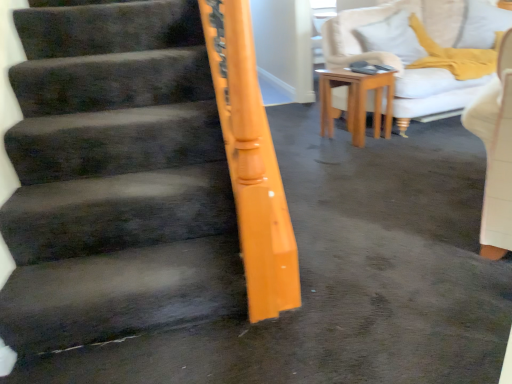
Question: Should I look upward or downward to see light brown wooden table at center?

Choices:
 (A) up
 (B) down

Answer: (A)

Question: Can you confirm if white soft pillow at upper right is taller than light brown wooden table at center?

Choices:
 (A) yes
 (B) no

Answer: (B)

Question: Considering the relative sizes of white soft pillow at upper right and light brown wooden table at center in the image provided, is white soft pillow at upper right shorter than light brown wooden table at center?

Choices:
 (A) yes
 (B) no

Answer: (A)

Question: Considering the relative sizes of white soft pillow at upper right and light brown wooden table at center in the image provided, is white soft pillow at upper right smaller than light brown wooden table at center?

Choices:
 (A) no
 (B) yes

Answer: (A)

Question: From the image's perspective, is white soft pillow at upper right located beneath light brown wooden table at center?

Choices:
 (A) no
 (B) yes

Answer: (A)

Question: Considering the relative positions of white soft pillow at upper right and light brown wooden table at center in the image provided, is white soft pillow at upper right behind light brown wooden table at center?

Choices:
 (A) yes
 (B) no

Answer: (A)

Question: Does white soft pillow at upper right appear on the left side of light brown wooden table at center?

Choices:
 (A) yes
 (B) no

Answer: (B)

Question: From a real-world perspective, is light brown wooden table at center positioned under white soft pillow at upper right based on gravity?

Choices:
 (A) no
 (B) yes

Answer: (B)

Question: Considering the relative sizes of light brown wooden table at center and white soft pillow at upper right in the image provided, is light brown wooden table at center thinner than white soft pillow at upper right?

Choices:
 (A) yes
 (B) no

Answer: (B)

Question: Is light brown wooden table at center oriented towards white soft pillow at upper right?

Choices:
 (A) no
 (B) yes

Answer: (A)

Question: Considering the relative sizes of light brown wooden table at center and white soft pillow at upper right in the image provided, is light brown wooden table at center bigger than white soft pillow at upper right?

Choices:
 (A) no
 (B) yes

Answer: (A)

Question: Is light brown wooden table at center further to the viewer compared to white soft pillow at upper right?

Choices:
 (A) yes
 (B) no

Answer: (B)

Question: From the image's perspective, is light brown wooden table at center under white soft pillow at upper right?

Choices:
 (A) yes
 (B) no

Answer: (A)

Question: In terms of size, does light brown wooden table at center appear bigger or smaller than white soft pillow at upper right?

Choices:
 (A) small
 (B) big

Answer: (A)